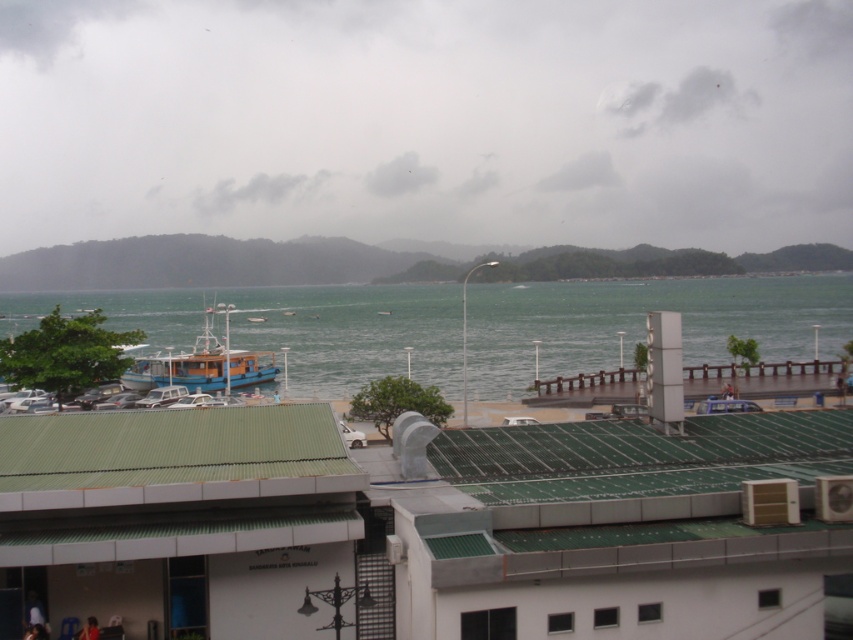
Question: Which point is closer to the camera?

Choices:
 (A) blue-green water at center
 (B) blue wooden boat at center-left

Answer: (A)

Question: Is blue-green water at center to the right of blue wooden boat at center-left from the viewer's perspective?

Choices:
 (A) yes
 (B) no

Answer: (A)

Question: Which point is closer to the camera?

Choices:
 (A) blue wooden boat at center-left
 (B) blue-green water at center

Answer: (B)

Question: In this image, where is blue-green water at center located relative to blue wooden boat at center-left?

Choices:
 (A) below
 (B) above

Answer: (B)

Question: Does blue-green water at center have a greater width compared to blue wooden boat at center-left?

Choices:
 (A) no
 (B) yes

Answer: (B)